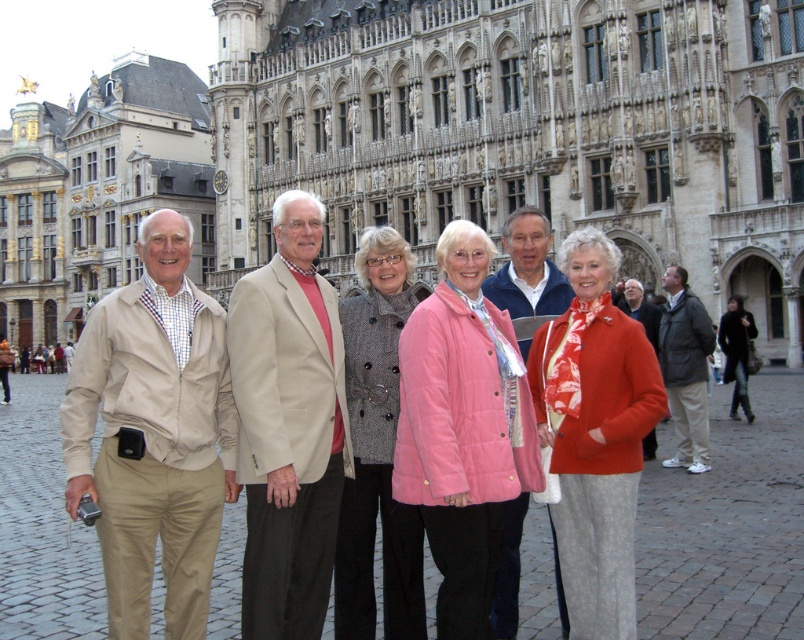
Locate an element on the screen. This screenshot has height=640, width=804. pink quilted jacket at center is located at coordinates [462, 429].

Can you confirm if pink quilted jacket at center is bigger than dark gray jacket at center?

Actually, pink quilted jacket at center might be smaller than dark gray jacket at center.

Image resolution: width=804 pixels, height=640 pixels. Identify the location of pink quilted jacket at center. (462, 429).

Which is more to the left, stone carved building at center or beige fabric jacket at center?

From the viewer's perspective, beige fabric jacket at center appears more on the left side.

How distant is stone carved building at center from beige fabric jacket at center?

stone carved building at center is 61.76 feet from beige fabric jacket at center.

In order to click on stone carved building at center in this screenshot , I will do `click(524, 131)`.

Which is in front, point (507, 540) or point (695, 388)?

Positioned in front is point (507, 540).

Between point (568, 304) and point (704, 448), which one is positioned behind?

Point (704, 448)

Is point (519, 556) positioned behind point (662, 464)?

No, it is not.

Locate an element on the screen. This screenshot has height=640, width=804. blue quilted jacket at center is located at coordinates (527, 268).